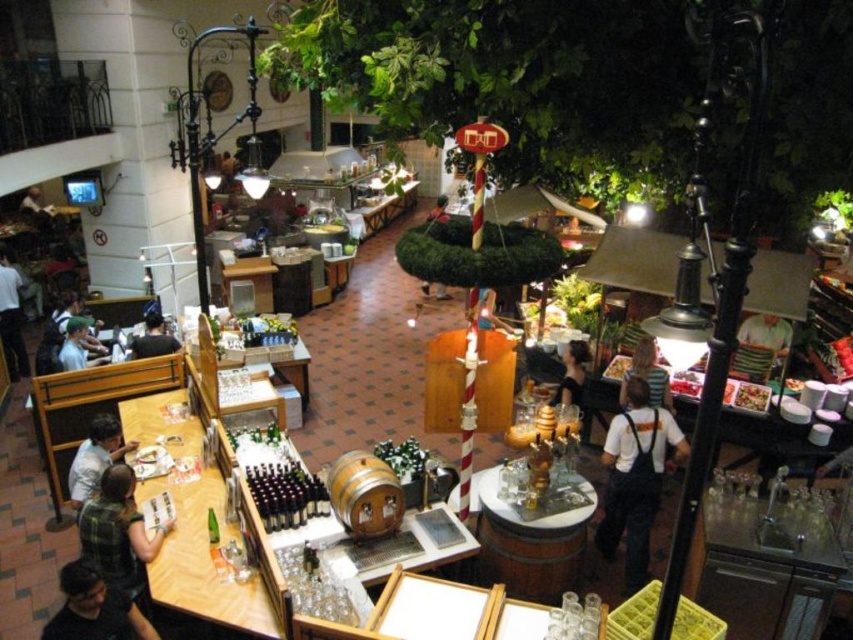
Which of these two, wooden barrel at center or matte black shirt at left, stands shorter?

With less height is matte black shirt at left.

Is wooden barrel at center shorter than matte black shirt at left?

No, wooden barrel at center is not shorter than matte black shirt at left.

Image resolution: width=853 pixels, height=640 pixels. What do you see at coordinates (531, 541) in the screenshot?
I see `wooden barrel at center` at bounding box center [531, 541].

This screenshot has height=640, width=853. What are the coordinates of `wooden barrel at center` in the screenshot? It's located at (531, 541).

The height and width of the screenshot is (640, 853). Describe the element at coordinates (96, 458) in the screenshot. I see `light brown hair at lower left` at that location.

Is light brown hair at lower left to the left of smooth black shirt at center from the viewer's perspective?

Indeed, light brown hair at lower left is positioned on the left side of smooth black shirt at center.

The image size is (853, 640). Describe the element at coordinates (96, 458) in the screenshot. I see `light brown hair at lower left` at that location.

Find the location of a particular element. Image resolution: width=853 pixels, height=640 pixels. light brown hair at lower left is located at coordinates (96, 458).

Can you confirm if striped shirt at center is positioned above smooth wooden table at center?

Actually, striped shirt at center is below smooth wooden table at center.

Is point (621, 403) closer to viewer compared to point (490, 310)?

Yes, it is in front of point (490, 310).

This screenshot has width=853, height=640. What are the coordinates of `striped shirt at center` in the screenshot? It's located at (647, 376).